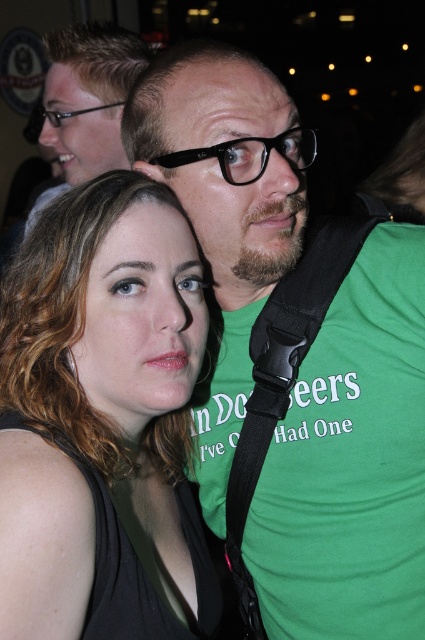
You are a fashion designer analyzing the image. You need to determine if the matte black tank top at center can be paired with the matte black glasses at upper left in terms of size. Which item is narrower?

The matte black tank top at center is narrower than the matte black glasses at upper left since its width is less than the glasses.

You are standing in a room and see the matte black glasses at upper left and the black plastic glasses at upper center. If you want to place a small vase between them, what is the minimum distance the vase should be in centimeters to fit between them?

The minimum distance the vase should be is 322 centimeters because the distance between the matte black glasses at upper left and the black plastic glasses at upper center is 3.22 meters.

You are a photographer adjusting the focus of your camera. You need to ensure that the matte black glasses at upper left are in focus. What are the exact coordinates where you should adjust the focus to?

The exact coordinates to focus on are at point (x=87, y=100) to ensure the matte black glasses at upper left are in focus.